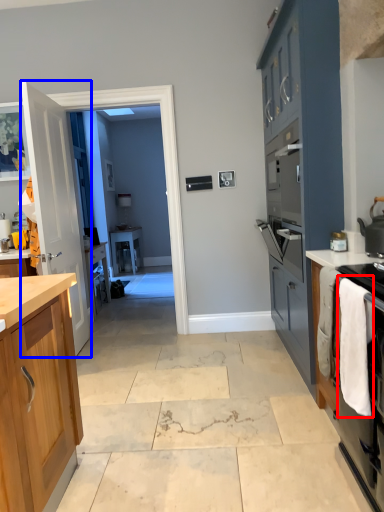
Question: Which object appears farthest to the camera in this image, laundry (highlighted by a red box) or door (highlighted by a blue box)?

Choices:
 (A) laundry
 (B) door

Answer: (B)